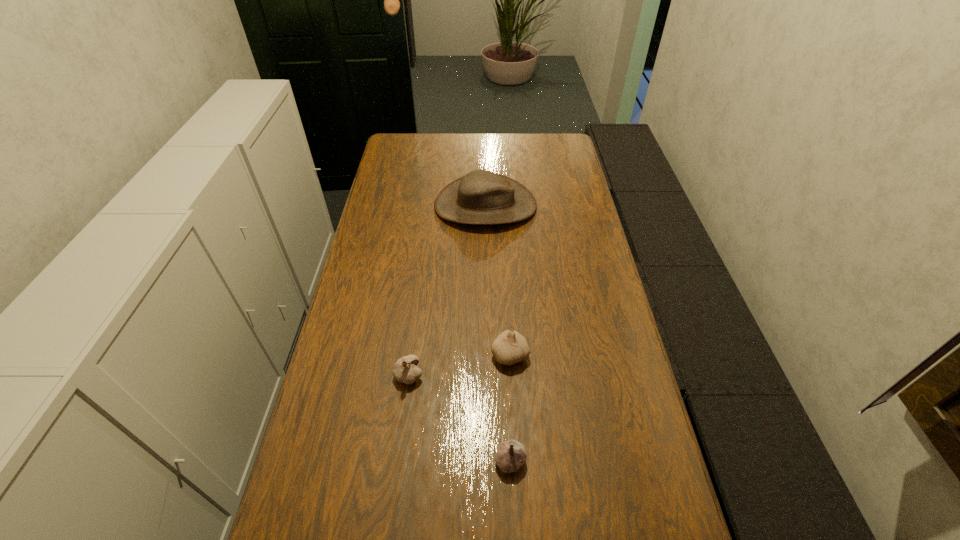
Find the location of a particular element. Image resolution: width=960 pixels, height=540 pixels. cowboy hat is located at coordinates (481, 197).

Image resolution: width=960 pixels, height=540 pixels. I want to click on the tallest object, so coord(481,197).

The height and width of the screenshot is (540, 960). In order to click on the leftmost garlic in this screenshot , I will do `click(405, 370)`.

You are a GUI agent. You are given a task and a screenshot of the screen. Output one action in this format:
    pyautogui.click(x=<x>, y=<y>)
    Task: Click on the nearest garlic
    The width and height of the screenshot is (960, 540).
    Given the screenshot: What is the action you would take?
    pyautogui.click(x=511, y=455)

Identify the location of vacant space situated on the front of the cowboy hat. Image resolution: width=960 pixels, height=540 pixels. (487, 320).

At what (x,y) coordinates should I click in order to perform the action: click on vacant space situated 0.220m on the back of the leftmost garlic. Please return your answer as a coordinate pair (x, y). The image size is (960, 540). Looking at the image, I should click on coord(419,300).

In order to click on vacant space located 0.100m on the right of the nearest object in this screenshot , I will do `click(569, 460)`.

This screenshot has width=960, height=540. I want to click on vacant position at the far edge of the desktop, so click(492, 151).

Identify the location of blank area at the left edge. This screenshot has width=960, height=540. (413, 174).

Where is `vacant region at the right edge`? vacant region at the right edge is located at coordinates (621, 325).